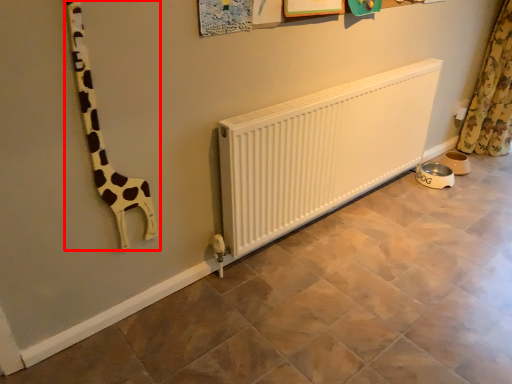
Question: From the image's perspective, what is the correct spatial relationship of giraffe (annotated by the red box) in relation to curtain?

Choices:
 (A) below
 (B) above

Answer: (A)